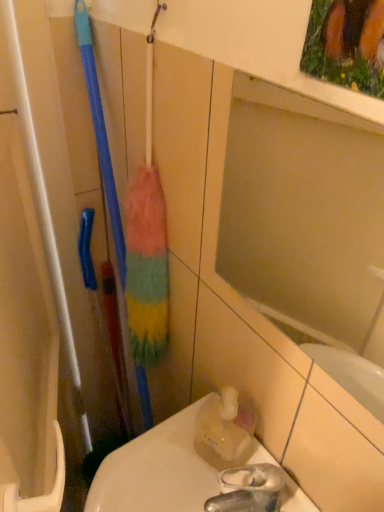
Identify the location of translucent plastic toilet at lower right. The height and width of the screenshot is (512, 384). tap(156, 471).

Locate an element on the screen. This screenshot has width=384, height=512. translucent plastic bottle at lower right is located at coordinates (224, 430).

How many degrees apart are the facing directions of translucent plastic bottle at lower right and matte glass mirror at upper center?

The facing directions of translucent plastic bottle at lower right and matte glass mirror at upper center are 2.03 degrees apart.

From a real-world perspective, is translucent plastic bottle at lower right beneath matte glass mirror at upper center?

Correct, in the physical world, translucent plastic bottle at lower right is lower than matte glass mirror at upper center.

From the image's perspective, is translucent plastic bottle at lower right positioned above or below matte glass mirror at upper center?

Based on their image positions, translucent plastic bottle at lower right is located beneath matte glass mirror at upper center.

Between translucent plastic bottle at lower right and matte glass mirror at upper center, which one has larger size?

Bigger between the two is matte glass mirror at upper center.

Where is `mirror above the translucent plastic toilet at lower right (from the image's perspective)`? The image size is (384, 512). mirror above the translucent plastic toilet at lower right (from the image's perspective) is located at coordinates (307, 228).

Looking at the image, does translucent plastic toilet at lower right seem bigger or smaller compared to matte glass mirror at upper center?

Considering their sizes, translucent plastic toilet at lower right takes up more space than matte glass mirror at upper center.

Is translucent plastic toilet at lower right outside of matte glass mirror at upper center?

Indeed, translucent plastic toilet at lower right is completely outside matte glass mirror at upper center.

Is translucent plastic toilet at lower right aimed at matte glass mirror at upper center?

No, translucent plastic toilet at lower right is not turned towards matte glass mirror at upper center.

Is translucent plastic toilet at lower right spatially inside translucent plastic bottle at lower right, or outside of it?

translucent plastic toilet at lower right is spatially situated outside translucent plastic bottle at lower right.

Is the depth of translucent plastic toilet at lower right less than that of translucent plastic bottle at lower right?

Yes, the depth of translucent plastic toilet at lower right is less than that of translucent plastic bottle at lower right.

You are a GUI agent. You are given a task and a screenshot of the screen. Output one action in this format:
    pyautogui.click(x=<x>, y=<y>)
    Task: Click on the toilet on the left of translucent plastic bottle at lower right
    The width and height of the screenshot is (384, 512).
    Given the screenshot: What is the action you would take?
    pyautogui.click(x=156, y=471)

Which is closer to the camera, (x=261, y=109) or (x=99, y=473)?

Point (x=261, y=109) is positioned farther from the camera compared to point (x=99, y=473).

Can you confirm if matte glass mirror at upper center is wider than translucent plastic toilet at lower right?

In fact, matte glass mirror at upper center might be narrower than translucent plastic toilet at lower right.

Is translucent plastic toilet at lower right a part of matte glass mirror at upper center?

No, translucent plastic toilet at lower right is not a part of matte glass mirror at upper center.

Consider the image. Is translucent plastic toilet at lower right at the back of matte glass mirror at upper center?

matte glass mirror at upper center is not turned away from translucent plastic toilet at lower right.

Is translucent plastic bottle at lower right located outside translucent plastic toilet at lower right?

Absolutely, translucent plastic bottle at lower right is external to translucent plastic toilet at lower right.

Considering the positions of objects translucent plastic bottle at lower right and translucent plastic toilet at lower right in the image provided, who is in front, translucent plastic bottle at lower right or translucent plastic toilet at lower right?

translucent plastic toilet at lower right is in front.

From a real-world perspective, relative to translucent plastic toilet at lower right, is translucent plastic bottle at lower right vertically above or below?

translucent plastic bottle at lower right is above translucent plastic toilet at lower right.

Considering the positions of objects translucent plastic bottle at lower right and translucent plastic toilet at lower right in the image provided, who is more to the right, translucent plastic bottle at lower right or translucent plastic toilet at lower right?

translucent plastic bottle at lower right is more to the right.

From a real-world perspective, is matte glass mirror at upper center on top of translucent plastic bottle at lower right?

Yes.

Is point (301, 114) positioned after point (225, 422)?

Yes, point (301, 114) is behind point (225, 422).

Is the depth of matte glass mirror at upper center less than that of translucent plastic bottle at lower right?

Yes, matte glass mirror at upper center is in front of translucent plastic bottle at lower right.

Could you measure the distance between matte glass mirror at upper center and translucent plastic bottle at lower right?

The distance of matte glass mirror at upper center from translucent plastic bottle at lower right is 15.31 inches.

Identify the location of mirror lying in front of the translucent plastic bottle at lower right. Image resolution: width=384 pixels, height=512 pixels. (307, 228).

In the image, there is a matte glass mirror at upper center. Identify the location of toilet below it (from the image's perspective). This screenshot has width=384, height=512. (156, 471).

Which object lies nearer to the anchor point translucent plastic toilet at lower right, translucent plastic bottle at lower right or matte glass mirror at upper center?

Among the two, translucent plastic bottle at lower right is located nearer to translucent plastic toilet at lower right.

Based on their spatial positions, is matte glass mirror at upper center or translucent plastic toilet at lower right further from translucent plastic bottle at lower right?

The object further to translucent plastic bottle at lower right is matte glass mirror at upper center.

From the image, which object appears to be farther from matte glass mirror at upper center, translucent plastic bottle at lower right or translucent plastic toilet at lower right?

translucent plastic toilet at lower right is positioned further to the anchor matte glass mirror at upper center.

Based on their spatial positions, is translucent plastic toilet at lower right or matte glass mirror at upper center closer to translucent plastic bottle at lower right?

Among the two, translucent plastic toilet at lower right is located nearer to translucent plastic bottle at lower right.

Estimate the real-world distances between objects in this image. Which object is closer to matte glass mirror at upper center, translucent plastic toilet at lower right or translucent plastic bottle at lower right?

translucent plastic bottle at lower right is closer to matte glass mirror at upper center.

Estimate the real-world distances between objects in this image. Which object is further from translucent plastic toilet at lower right, matte glass mirror at upper center or translucent plastic bottle at lower right?

Based on the image, matte glass mirror at upper center appears to be further to translucent plastic toilet at lower right.

Locate an element on the screen. cleaning product between matte glass mirror at upper center and translucent plastic toilet at lower right from top to bottom is located at coordinates (224, 430).